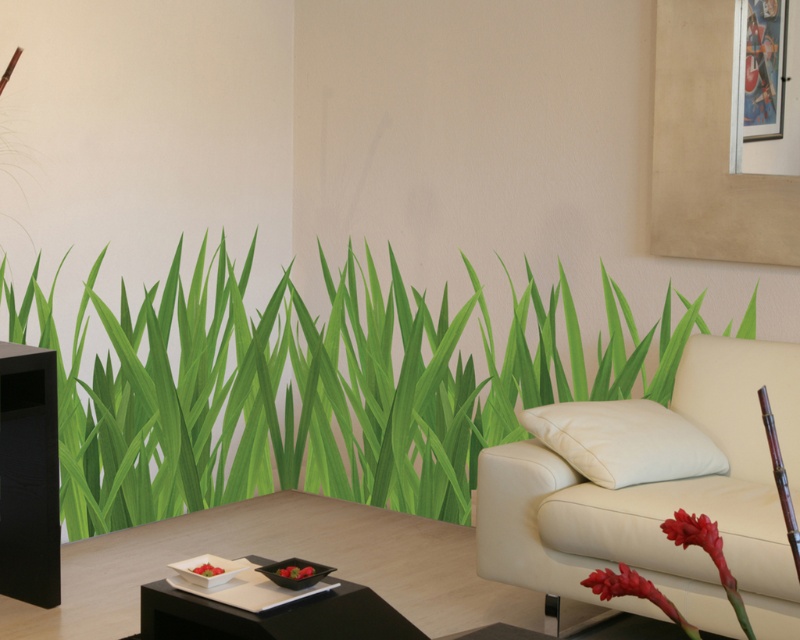
At what (x,y) coordinates should I click in order to perform the action: click on green matte grass at center. Please return your answer as a coordinate pair (x, y). Looking at the image, I should click on (314, 390).

Can you confirm if green matte grass at center is taller than white leather couch at upper right?

Yes.

Which is behind, point (113, 492) or point (762, 468)?

Point (113, 492)

Image resolution: width=800 pixels, height=640 pixels. In order to click on green matte grass at center in this screenshot , I will do `click(314, 390)`.

Who is positioned more to the left, green matte grass at center or black glossy side table at lower center?

black glossy side table at lower center is more to the left.

Between green matte grass at center and black glossy side table at lower center, which one has more height?

Standing taller between the two is green matte grass at center.

Locate an element on the screen. The image size is (800, 640). green matte grass at center is located at coordinates (314, 390).

Consider the image. Between white leather couch at upper right and black glossy side table at lower center, which one appears on the right side from the viewer's perspective?

From the viewer's perspective, white leather couch at upper right appears more on the right side.

Does white leather couch at upper right appear under black glossy side table at lower center?

No, white leather couch at upper right is not below black glossy side table at lower center.

Is point (694, 392) positioned before point (376, 632)?

No.

Find the location of a particular element. white leather couch at upper right is located at coordinates (656, 490).